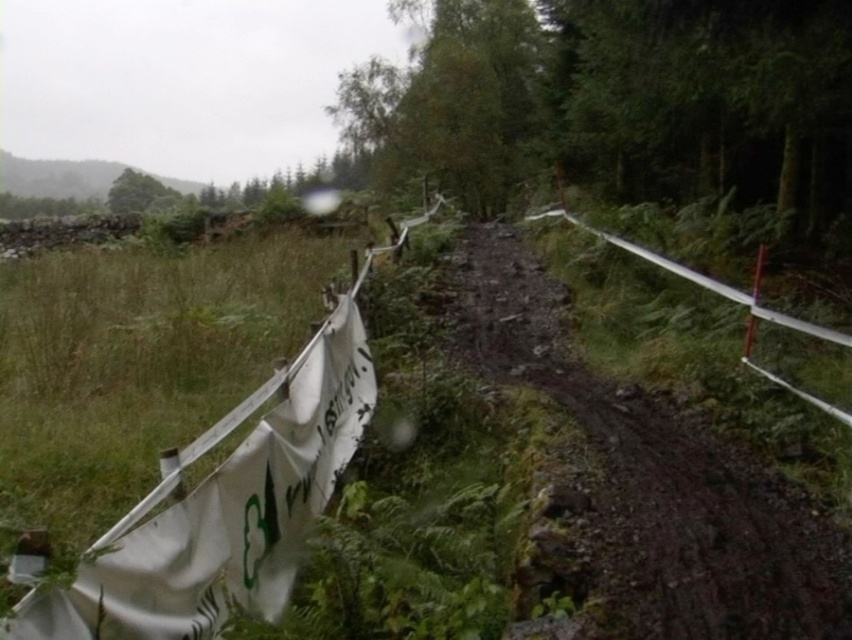
Measure the distance between point (588, 493) and camera.

The distance of point (588, 493) from camera is 3.82 meters.

Between dull brown dirt track at center and white fabric banner at left, which one appears on the left side from the viewer's perspective?

Positioned to the left is white fabric banner at left.

In order to click on dull brown dirt track at center in this screenshot , I will do (x=655, y=481).

Who is more forward, (193, 547) or (114, 188)?

Answer: Positioned in front is point (193, 547).

Is white fabric banner at left shorter than green leafy tree at upper left?

Correct, white fabric banner at left is not as tall as green leafy tree at upper left.

Describe the element at coordinates (228, 504) in the screenshot. The height and width of the screenshot is (640, 852). I see `white fabric banner at left` at that location.

I want to click on white fabric banner at left, so point(228,504).

Can you confirm if white fabric banner at left is wider than metallic silver fence at center-right?

No.

Is white fabric banner at left above metallic silver fence at center-right?

No, white fabric banner at left is not above metallic silver fence at center-right.

Describe the element at coordinates (228, 504) in the screenshot. Image resolution: width=852 pixels, height=640 pixels. I see `white fabric banner at left` at that location.

What are the coordinates of `white fabric banner at left` in the screenshot? It's located at (228, 504).